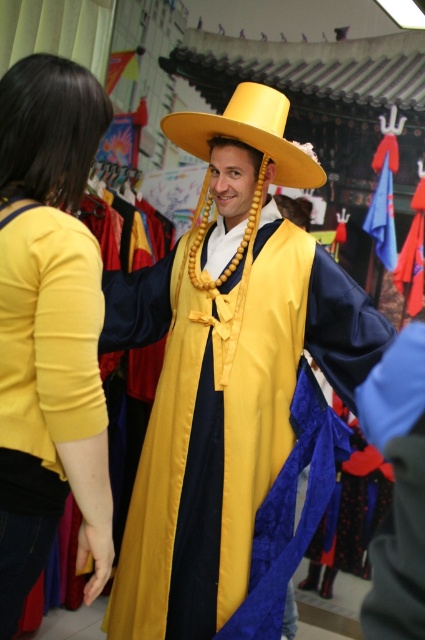
You are organizing a cultural event and need to display a satin yellow robe at center and a yellow matte cowboy hat at center. Which object should be placed on a higher shelf to ensure visibility while maintaining their proportional sizes?

The satin yellow robe at center should be placed on a higher shelf because it has a larger size compared to the yellow matte cowboy hat at center, ensuring visibility while maintaining their proportional sizes.

You are a photographer setting up a shoot in this traditional Korean clothing store. You need to position a spotlight to highlight the matte yellow blouse at left. According to the coordinates provided, where should you aim the spotlight?

The matte yellow blouse at left is located at point (48, 324), so you should aim the spotlight at those coordinates to highlight it.

You are a photographer preparing for a photoshoot and notice the satin yellow robe at center and the yellow matte cowboy hat at center in the scene. Which object is located to the left of the other?

The satin yellow robe at center is positioned on the left side of yellow matte cowboy hat at center.